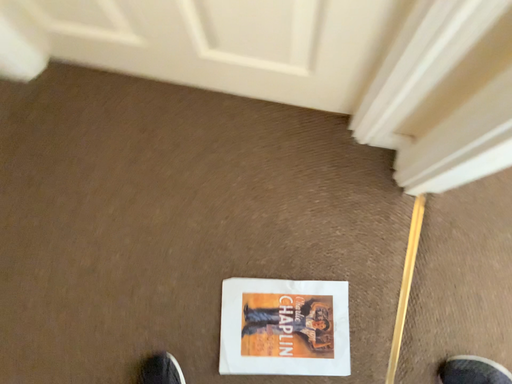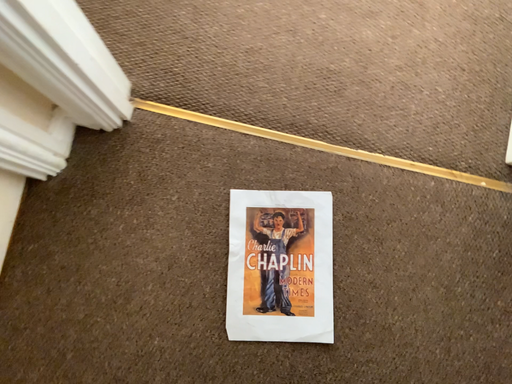
Question: Which way did the camera rotate in the video?

Choices:
 (A) rotated left
 (B) rotated right

Answer: (B)